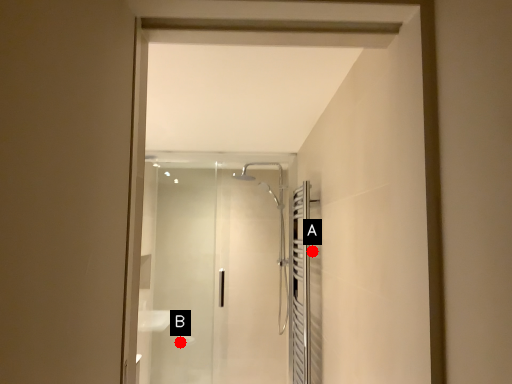
Question: Two points are circled on the image, labeled by A and B beside each circle. Which point appears farthest from the camera in this image?

Choices:
 (A) A is further
 (B) B is further

Answer: (B)